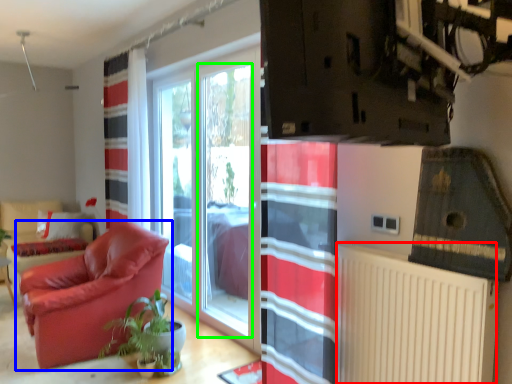
Question: Estimate the real-world distances between objects in this image. Which object is farther from radiator (highlighted by a red box), chair (highlighted by a blue box) or window screen (highlighted by a green box)?

Choices:
 (A) chair
 (B) window screen

Answer: (A)